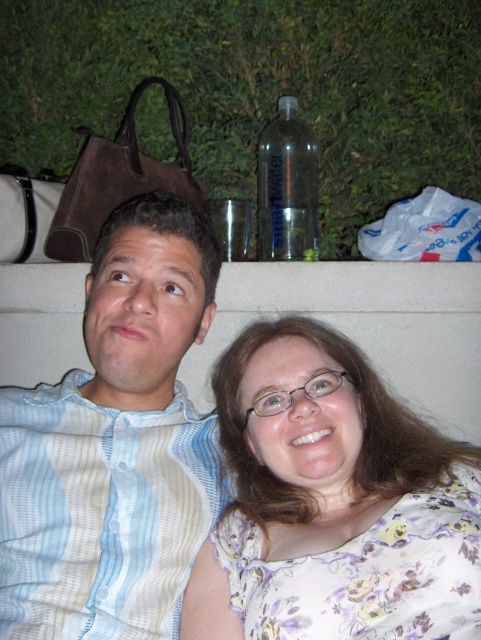
Between light blue striped shirt at left and white striped shirt at upper left, which one is positioned higher?

white striped shirt at upper left

Does light blue striped shirt at left come in front of white striped shirt at upper left?

That is True.

Is point (152, 257) positioned in front of point (177, 499)?

No, it is not.

Identify the location of light blue striped shirt at left. (114, 445).

At what (x,y) coordinates should I click in order to perform the action: click on light blue striped shirt at left. Please return your answer as a coordinate pair (x, y). This screenshot has height=640, width=481. Looking at the image, I should click on (114, 445).

The width and height of the screenshot is (481, 640). Find the location of `floral fabric blouse at lower right`. floral fabric blouse at lower right is located at coordinates (332, 502).